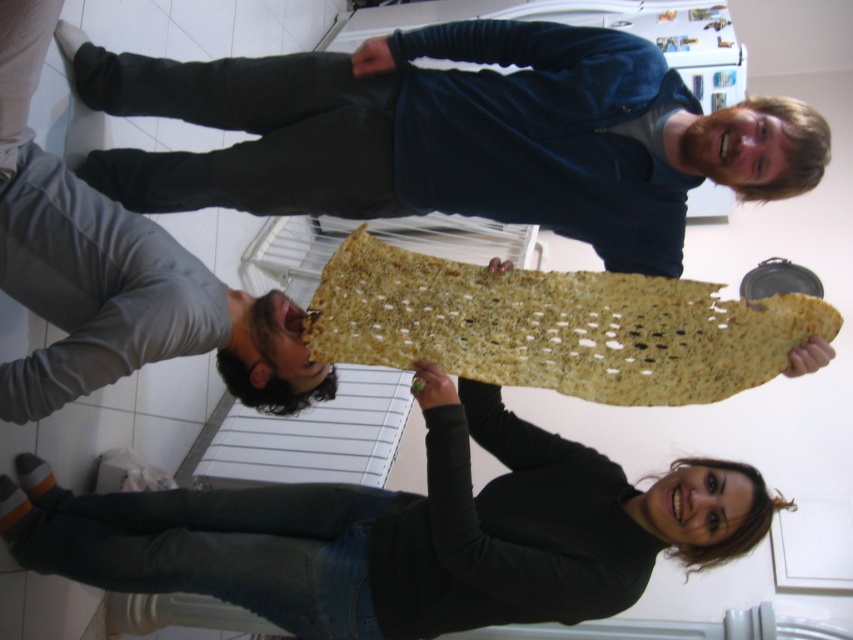
Which is in front, point (294, 172) or point (106, 196)?

Positioned in front is point (106, 196).

Is knitted fabric at upper center further to the viewer compared to gray matte pants at lower left?

Yes, knitted fabric at upper center is behind gray matte pants at lower left.

Identify the location of knitted fabric at upper center. The height and width of the screenshot is (640, 853). (453, 134).

Image resolution: width=853 pixels, height=640 pixels. Identify the location of knitted fabric at upper center. (453, 134).

The image size is (853, 640). Describe the element at coordinates (453, 134) in the screenshot. I see `knitted fabric at upper center` at that location.

Who is more distant from viewer, [445,189] or [48,550]?

The point [445,189] is more distant.

Is point (685, 104) closer to viewer compared to point (321, 573)?

No, (685, 104) is further to viewer.

Locate an element on the screen. knitted fabric at upper center is located at coordinates (453, 134).

Between point (440, 483) and point (413, 294), which one is positioned in front?

Point (440, 483) is in front.

Does matte yellow fabric at center have a greater width compared to golden textured matzah at center?

Correct, the width of matte yellow fabric at center exceeds that of golden textured matzah at center.

Who is more distant from viewer, (253, 493) or (740, 330)?

The point (253, 493) is behind.

At what (x,y) coordinates should I click in order to perform the action: click on matte yellow fabric at center. Please return your answer as a coordinate pair (x, y). Looking at the image, I should click on (403, 532).